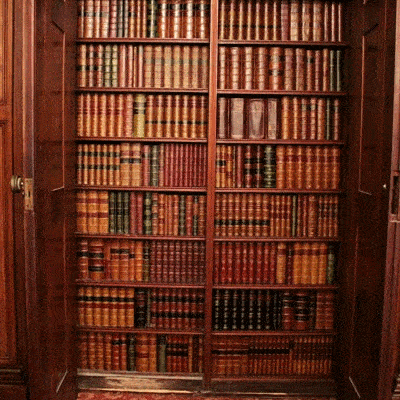
Identify the location of door panels. (50, 263), (53, 162), (374, 172), (366, 261).